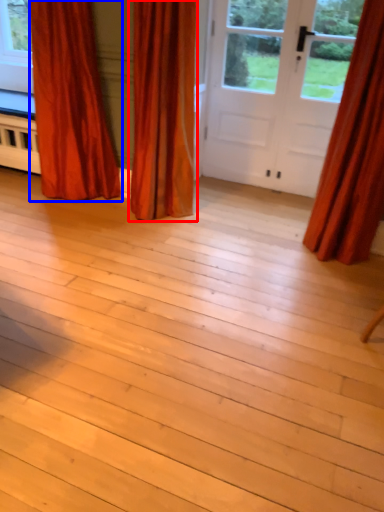
Question: Which of the following is the closest to the observer, curtain (highlighted by a red box) or curtain (highlighted by a blue box)?

Choices:
 (A) curtain
 (B) curtain

Answer: (A)